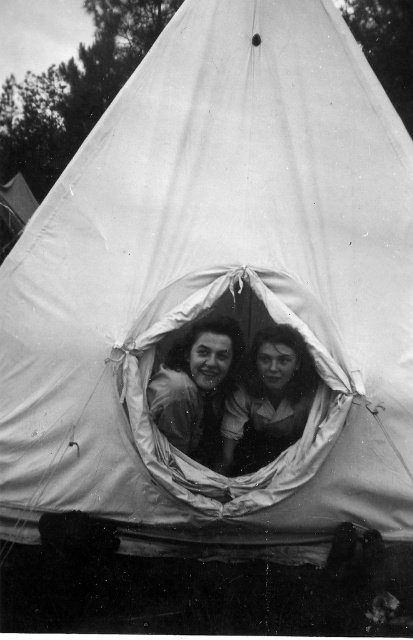
Based on the photo, does smooth skin face at center come behind smooth fabric face at center?

No, it is in front of smooth fabric face at center.

Consider the image. Can you confirm if smooth skin face at center is positioned below smooth fabric face at center?

No, smooth skin face at center is not below smooth fabric face at center.

Who is more forward, [209,349] or [268,381]?

Point [209,349] is in front.

In order to click on smooth skin face at center in this screenshot , I will do `click(197, 387)`.